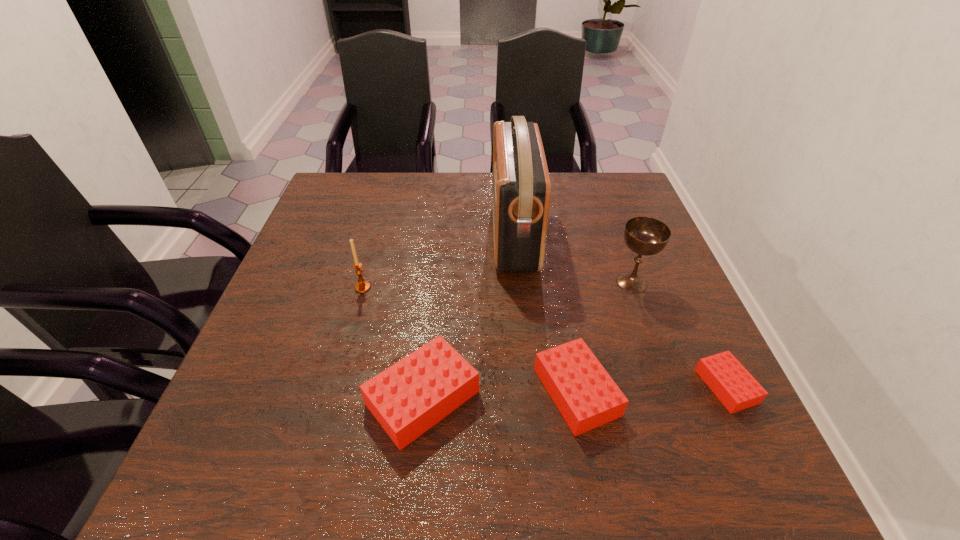
What are the coordinates of `the leftmost Lego` in the screenshot? It's located at (408, 398).

You are a GUI agent. You are given a task and a screenshot of the screen. Output one action in this format:
    pyautogui.click(x=<x>, y=<y>)
    Task: Click on the second Lego from left to right
    
    Given the screenshot: What is the action you would take?
    pyautogui.click(x=587, y=397)

Where is `the second shortest object`? the second shortest object is located at coordinates (587, 397).

Find the location of `the shortest object`. the shortest object is located at coordinates (734, 386).

You are a GUI agent. You are given a task and a screenshot of the screen. Output one action in this format:
    pyautogui.click(x=<x>, y=<y>)
    Task: Click on the rightmost Lego
    The width and height of the screenshot is (960, 540).
    Given the screenshot: What is the action you would take?
    pyautogui.click(x=734, y=386)

Find the location of a particular element. This screenshot has width=960, height=540. radio receiver is located at coordinates (521, 189).

This screenshot has height=540, width=960. Find the location of `candle_holder`. candle_holder is located at coordinates (362, 286).

At what (x,y) coordinates should I click in order to perform the action: click on chalice. Please return your answer as a coordinate pair (x, y). Image resolution: width=960 pixels, height=540 pixels. Looking at the image, I should click on (647, 236).

Identify the location of blank space located on the right of the fifth object from right to left. (565, 398).

The image size is (960, 540). Identify the location of vacant area situated 0.210m on the back of the second Lego from left to right. (556, 282).